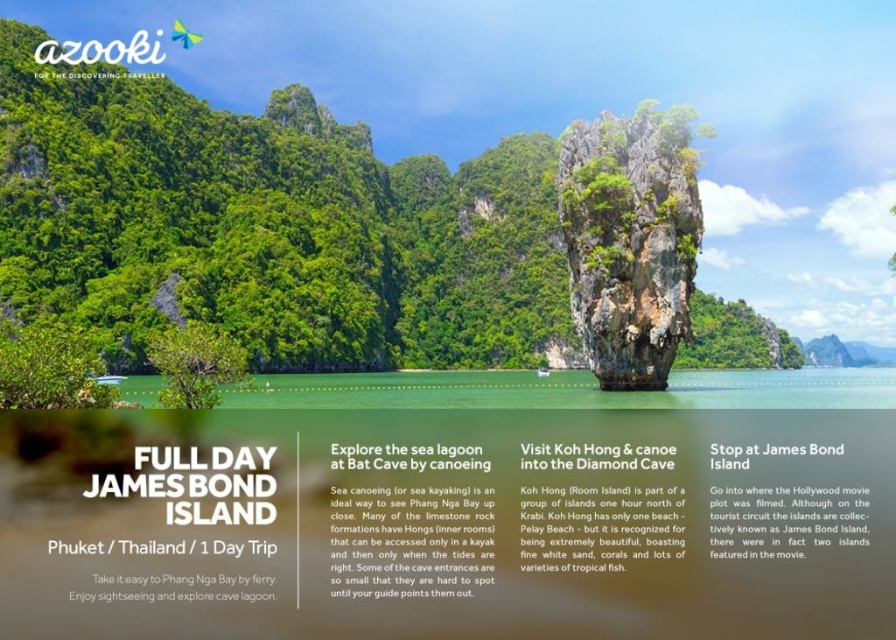
Which of these two, green textured rock formation at center or white paper at center, stands taller?

green textured rock formation at center

You are a GUI agent. You are given a task and a screenshot of the screen. Output one action in this format:
    pyautogui.click(x=<x>, y=<y>)
    Task: Click on the green textured rock formation at center
    
    Given the screenshot: What is the action you would take?
    point(630,241)

Between clear blue water at center and white paper text at right, which one appears on the left side from the viewer's perspective?

Positioned to the left is white paper text at right.

Is clear blue water at center positioned behind white paper text at right?

Yes.

Is point (682, 388) farther from viewer compared to point (721, 516)?

Yes, it is behind point (721, 516).

This screenshot has height=640, width=896. I want to click on clear blue water at center, so click(x=570, y=388).

What do you see at coordinates (630, 241) in the screenshot? Image resolution: width=896 pixels, height=640 pixels. I see `green textured rock formation at center` at bounding box center [630, 241].

Which is behind, point (679, 234) or point (823, 488)?

Positioned behind is point (679, 234).

Locate an element on the screen. green textured rock formation at center is located at coordinates (630, 241).